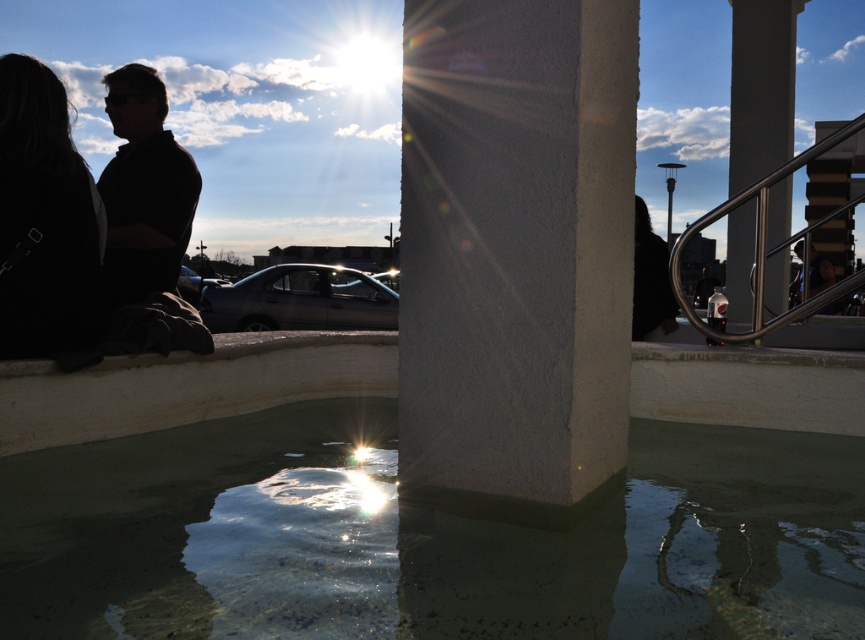
Does smooth concrete pillar at upper right appear on the right side of satin silver railing at upper right?

Indeed, smooth concrete pillar at upper right is positioned on the right side of satin silver railing at upper right.

Which is behind, point (764, 4) or point (763, 268)?

Point (764, 4)

At what (x,y) coordinates should I click in order to perform the action: click on smooth concrete pillar at upper right. Please return your answer as a coordinate pair (x, y). The image size is (865, 640). Looking at the image, I should click on (761, 88).

What do you see at coordinates (516, 244) in the screenshot? I see `white textured pillar at center` at bounding box center [516, 244].

Does point (567, 29) lie in front of point (391, 342)?

That is True.

Locate an element on the screen. The height and width of the screenshot is (640, 865). white textured pillar at center is located at coordinates (516, 244).

Can you confirm if white textured pillar at center is taller than satin silver railing at upper right?

Correct, white textured pillar at center is much taller as satin silver railing at upper right.

Which is more to the left, white textured pillar at center or satin silver railing at upper right?

white textured pillar at center

Find the location of a particular element. The image size is (865, 640). white textured pillar at center is located at coordinates (516, 244).